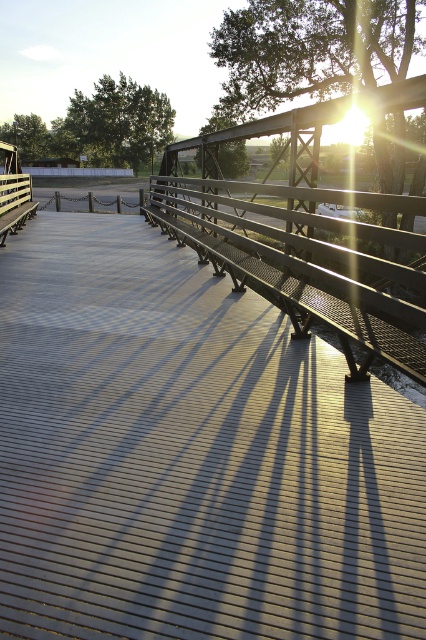
Question: Is metallic gray dock at center in front of metallic gray bench at center?

Choices:
 (A) yes
 (B) no

Answer: (A)

Question: Which point appears farthest from the camera in this image?

Choices:
 (A) (163, 212)
 (B) (359, 538)

Answer: (A)

Question: Among these points, which one is nearest to the camera?

Choices:
 (A) tap(103, 225)
 (B) tap(422, 380)

Answer: (B)

Question: Is metallic gray dock at center thinner than metallic gray bench at center?

Choices:
 (A) yes
 (B) no

Answer: (A)

Question: Can you confirm if metallic gray dock at center is positioned below metallic gray bench at center?

Choices:
 (A) yes
 (B) no

Answer: (A)